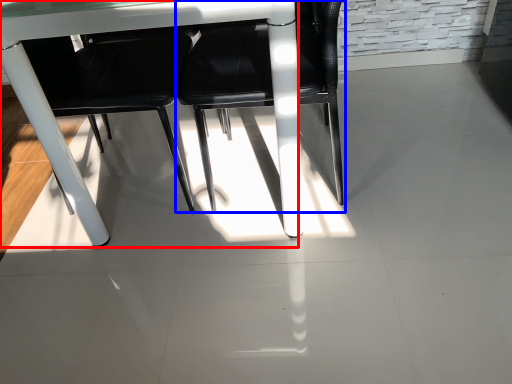
Question: Which object is closer to the camera taking this photo, table (highlighted by a red box) or chair (highlighted by a blue box)?

Choices:
 (A) table
 (B) chair

Answer: (A)